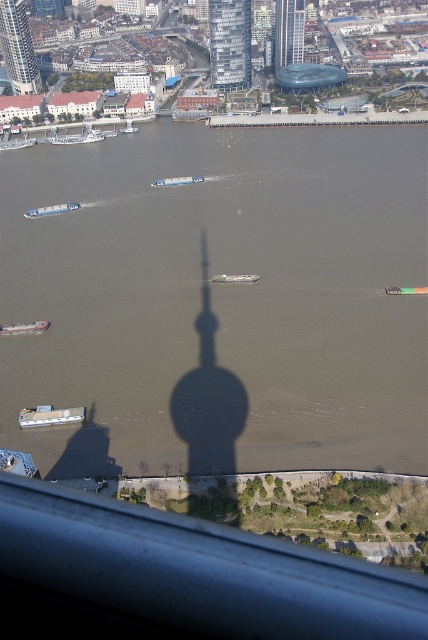
Question: Which of the following is the farthest from the observer?

Choices:
 (A) (297, 51)
 (B) (77, 204)

Answer: (A)

Question: In this image, where is blue matte barge at left located relative to white plastic boat at center?

Choices:
 (A) right
 (B) left

Answer: (B)

Question: Which of the following is the closest to the observer?

Choices:
 (A) (131, 122)
 (B) (166, 179)
 (C) (279, 49)
 (D) (26, 211)

Answer: (D)

Question: Is green plastic boat at center closer to camera compared to white plastic boat at center?

Choices:
 (A) yes
 (B) no

Answer: (A)

Question: Considering the relative positions of blue matte barge at left and white plastic boat at center in the image provided, where is blue matte barge at left located with respect to white plastic boat at center?

Choices:
 (A) right
 (B) left

Answer: (B)

Question: Which of the following is the closest to the observer?

Choices:
 (A) (220, 278)
 (B) (199, 179)
 (C) (388, 289)

Answer: (C)